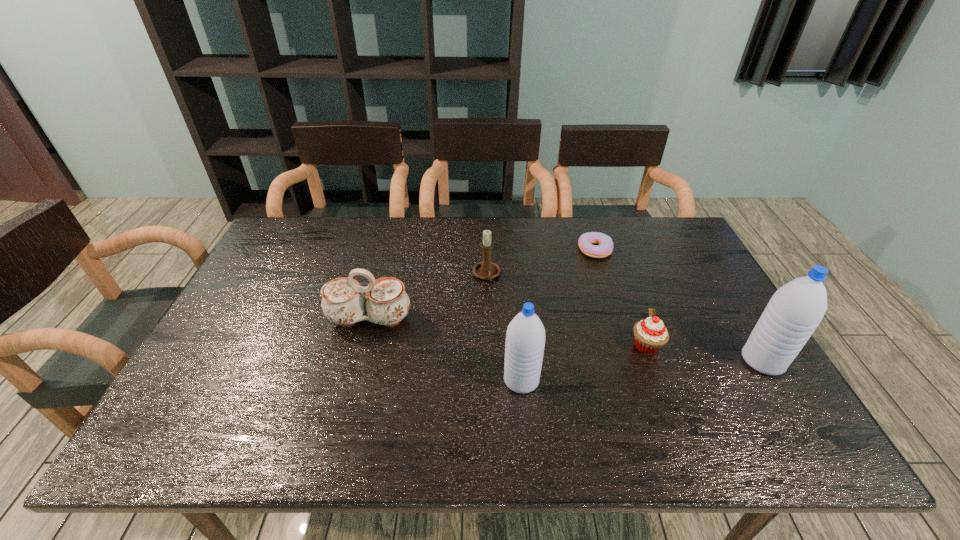
This screenshot has height=540, width=960. Identify the location of the left water bottle. (525, 339).

Where is `the second tallest object`? The height and width of the screenshot is (540, 960). the second tallest object is located at coordinates (525, 339).

Identify the location of the taller water bottle. (796, 309).

I want to click on the tallest object, so click(796, 309).

This screenshot has height=540, width=960. Find the location of `doughnut`. doughnut is located at coordinates (586, 240).

This screenshot has width=960, height=540. In order to click on the farthest object in this screenshot , I will do `click(586, 240)`.

At what (x,y) coordinates should I click in order to perform the action: click on candle holder. Please return your answer as a coordinate pair (x, y). Image resolution: width=960 pixels, height=540 pixels. Looking at the image, I should click on (486, 270).

Locate an element on the screen. the leftmost object is located at coordinates (343, 302).

At what (x,y) coordinates should I click in order to perform the action: click on the fifth tallest object. Please return your answer as a coordinate pair (x, y). Looking at the image, I should click on (650, 334).

At what (x,y) coordinates should I click in order to perform the action: click on free space located 0.180m on the left of the left water bottle. Please return your answer as a coordinate pair (x, y). This screenshot has width=960, height=540. Looking at the image, I should click on (429, 380).